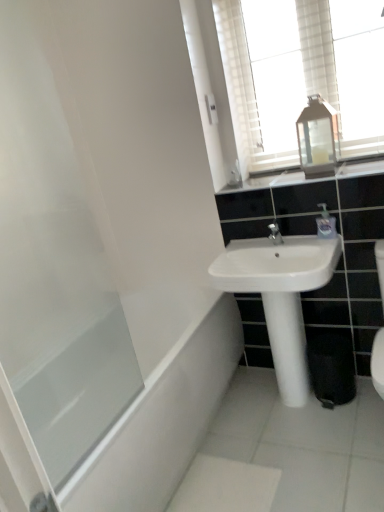
In order to face white glossy cabinet at upper center, should I rotate leftwards or rightwards?

A 14.052 degree turn to the right will do.

This screenshot has width=384, height=512. Describe the element at coordinates (162, 421) in the screenshot. I see `transparent glass bathtub at lower left` at that location.

This screenshot has width=384, height=512. In order to click on white glossy cabinet at upper center in this screenshot , I will do `click(307, 179)`.

Which of these two, transparent glass lantern at upper center or transparent glass screen door at left, is wider?

transparent glass lantern at upper center is wider.

This screenshot has height=512, width=384. What are the coordinates of `screen door below the transparent glass lantern at upper center (from the image's perspective)` in the screenshot? It's located at (53, 262).

Considering the sizes of transparent glass lantern at upper center and transparent glass screen door at left in the image, is transparent glass lantern at upper center taller or shorter than transparent glass screen door at left?

Considering their sizes, transparent glass lantern at upper center has less height than transparent glass screen door at left.

From the image's perspective, between transparent glass lantern at upper center and transparent glass screen door at left, who is located below?

transparent glass screen door at left appears lower in the image.

Locate an element on the screen. bath that is behind the transparent glass screen door at left is located at coordinates (162, 421).

Which object is positioned more to the left, transparent glass bathtub at lower left or transparent glass screen door at left?

From the viewer's perspective, transparent glass screen door at left appears more on the left side.

From the image's perspective, is transparent glass bathtub at lower left located above or below transparent glass screen door at left?

transparent glass bathtub at lower left is situated lower than transparent glass screen door at left in the image.

How many degrees apart are the facing directions of transparent glass bathtub at lower left and white ceramic sink at center?

91.2 degrees.

Between transparent glass bathtub at lower left and white ceramic sink at center, which one is positioned in front?

transparent glass bathtub at lower left is more forward.

Which of these two, transparent glass bathtub at lower left or white ceramic sink at center, stands shorter?

white ceramic sink at center is shorter.

Could you tell me if transparent glass bathtub at lower left is facing white ceramic sink at center?

No.

Does transparent glass bathtub at lower left have a greater height compared to white glossy cabinet at upper center?

Yes.

Which object is closer to the camera taking this photo, transparent glass bathtub at lower left or white glossy cabinet at upper center?

Positioned in front is transparent glass bathtub at lower left.

From the image's perspective, is transparent glass bathtub at lower left located above white glossy cabinet at upper center?

No, from the image's perspective, transparent glass bathtub at lower left is not on top of white glossy cabinet at upper center.

How different are the orientations of transparent glass bathtub at lower left and white glossy cabinet at upper center in degrees?

The angular difference between transparent glass bathtub at lower left and white glossy cabinet at upper center is 90.8 degrees.

You are a GUI agent. You are given a task and a screenshot of the screen. Output one action in this format:
    pyautogui.click(x=<x>, y=<y>)
    Task: Click on the toiletry located behind the transparent glass lantern at upper center
    The width and height of the screenshot is (384, 512).
    Given the screenshot: What is the action you would take?
    pyautogui.click(x=326, y=223)

Consider the image. Is transparent glass lantern at upper center positioned with its back to clear plastic soap dispenser at upper right?

transparent glass lantern at upper center does not have its back to clear plastic soap dispenser at upper right.

Considering their positions, is transparent glass lantern at upper center located in front of or behind clear plastic soap dispenser at upper right?

transparent glass lantern at upper center is in front of clear plastic soap dispenser at upper right.

In the scene shown: From a real-world perspective, is transparent glass lantern at upper center beneath white ceramic sink at center?

No, from a real-world perspective, transparent glass lantern at upper center is not below white ceramic sink at center.

From the image's perspective, is transparent glass lantern at upper center above or below white ceramic sink at center?

Clearly, from the image's perspective, transparent glass lantern at upper center is above white ceramic sink at center.

In terms of height, does transparent glass lantern at upper center look taller or shorter compared to white ceramic sink at center?

In the image, transparent glass lantern at upper center appears to be taller than white ceramic sink at center.

Do you think white ceramic sink at center is within white glossy cabinet at upper center, or outside of it?

white ceramic sink at center is not inside white glossy cabinet at upper center, it's outside.

In terms of height, does white ceramic sink at center look taller or shorter compared to white glossy cabinet at upper center?

Considering their sizes, white ceramic sink at center has more height than white glossy cabinet at upper center.

From a real-world perspective, which is physically below, white ceramic sink at center or white glossy cabinet at upper center?

From a 3D spatial view, white ceramic sink at center is below.

Locate an element on the screen. screen door that is on the left side of transparent glass lantern at upper center is located at coordinates pyautogui.click(x=53, y=262).

At what (x,y) coordinates should I click in order to perform the action: click on screen door above the transparent glass bathtub at lower left (from the image's perspective). Please return your answer as a coordinate pair (x, y). This screenshot has height=512, width=384. Looking at the image, I should click on (53, 262).

From the image, which object appears to be farther from transparent glass bathtub at lower left, clear glass lantern at upper right or transparent glass lantern at upper center?

Among the two, clear glass lantern at upper right is located further to transparent glass bathtub at lower left.

Estimate the real-world distances between objects in this image. Which object is closer to clear plastic soap dispenser at upper right, white ceramic sink at center or transparent glass bathtub at lower left?

white ceramic sink at center is closer to clear plastic soap dispenser at upper right.

From the image, which object appears to be farther from transparent glass lantern at upper center, transparent glass screen door at left or clear glass lantern at upper right?

transparent glass screen door at left is further to transparent glass lantern at upper center.

Considering their positions, is clear glass lantern at upper right positioned further to white glossy cabinet at upper center than clear plastic soap dispenser at upper right?

clear glass lantern at upper right lies further to white glossy cabinet at upper center than the other object.

Estimate the real-world distances between objects in this image. Which object is further from clear glass lantern at upper right, white glossy cabinet at upper center or transparent glass lantern at upper center?

Based on the image, white glossy cabinet at upper center appears to be further to clear glass lantern at upper right.

Considering their positions, is white ceramic sink at center positioned closer to transparent glass screen door at left than white glossy cabinet at upper center?

Based on the image, white ceramic sink at center appears to be nearer to transparent glass screen door at left.

From the image, which object appears to be farther from transparent glass lantern at upper center, transparent glass screen door at left or transparent glass bathtub at lower left?

Answer: transparent glass screen door at left lies further to transparent glass lantern at upper center than the other object.

Looking at the image, which one is located further to clear plastic soap dispenser at upper right, transparent glass bathtub at lower left or transparent glass lantern at upper center?

transparent glass bathtub at lower left is further to clear plastic soap dispenser at upper right.

Identify the location of toiletry that lies between clear glass lantern at upper right and transparent glass bathtub at lower left from top to bottom. The height and width of the screenshot is (512, 384). [326, 223].

The width and height of the screenshot is (384, 512). Identify the location of sink between transparent glass screen door at left and transparent glass lantern at upper center in the front-back direction. (276, 265).

The height and width of the screenshot is (512, 384). I want to click on toiletry between transparent glass lantern at upper center and white ceramic sink at center from top to bottom, so click(326, 223).

This screenshot has width=384, height=512. I want to click on medicine cabinet that lies between clear glass lantern at upper right and white ceramic sink at center from top to bottom, so click(318, 138).